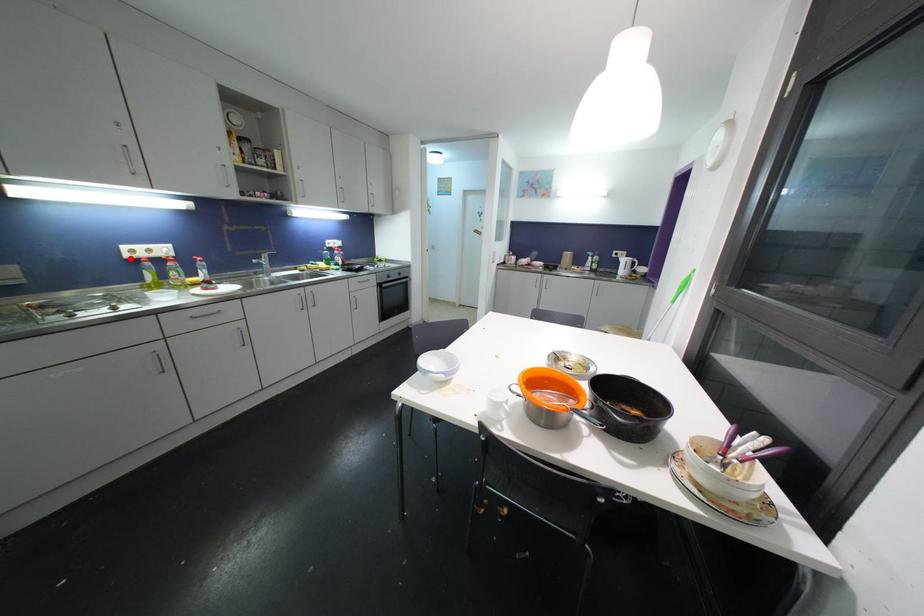
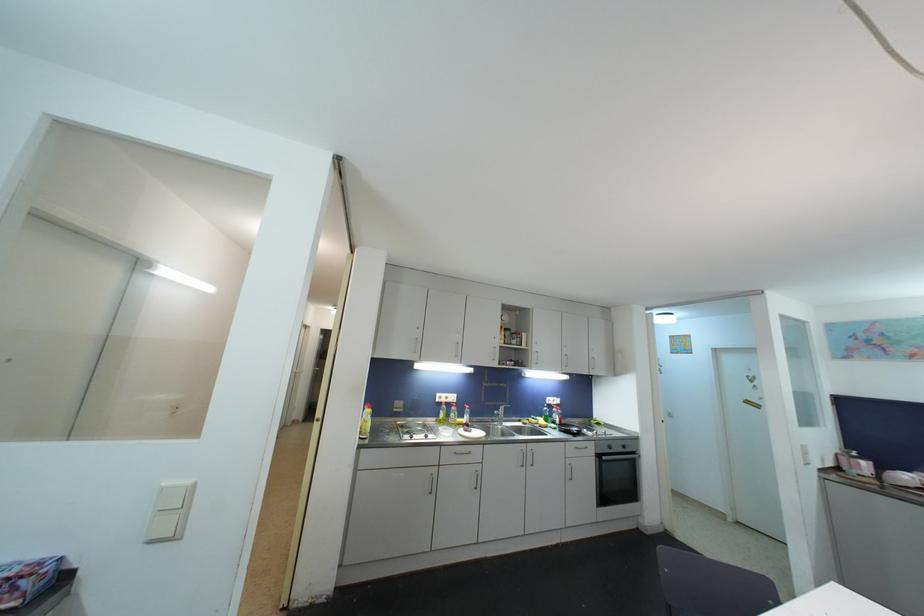
Question: I am providing you with two images of the same scene from different viewpoints. Given a red point in image1, look at the same physical point in image2. Is it:

Choices:
 (A) Closer to the viewpoint
 (B) Farther from the viewpoint

Answer: (B)